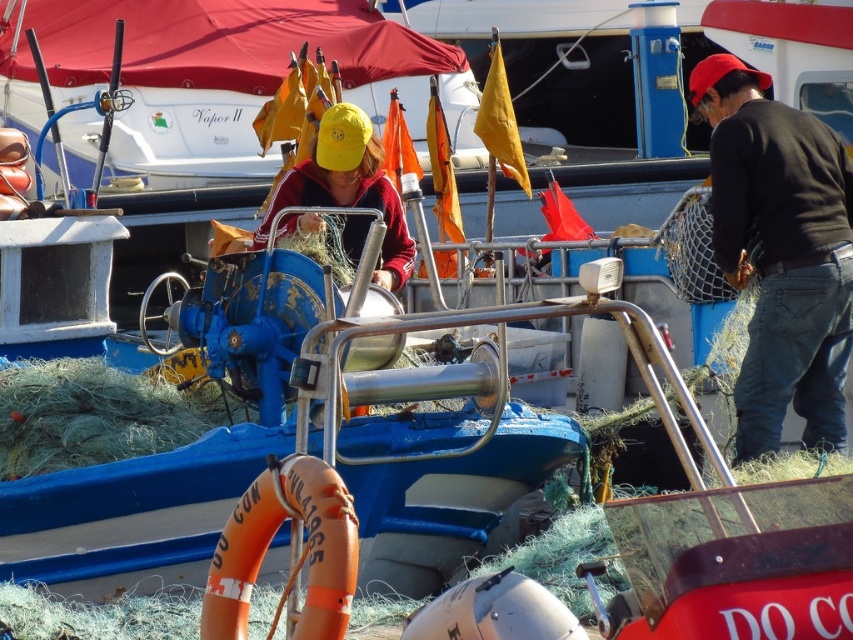
Who is more forward, (x=322, y=465) or (x=399, y=275)?

Positioned in front is point (x=322, y=465).

Is orange rubber life jacket at lower center to the right of matte red jacket at center from the viewer's perspective?

Correct, you'll find orange rubber life jacket at lower center to the right of matte red jacket at center.

Which is in front, point (329, 499) or point (384, 218)?

Point (329, 499)

Locate an element on the screen. This screenshot has height=640, width=853. orange rubber life jacket at lower center is located at coordinates (294, 561).

Does black cotton shirt at right have a greater width compared to orange rubber life jacket at lower center?

Correct, the width of black cotton shirt at right exceeds that of orange rubber life jacket at lower center.

Which of these two, black cotton shirt at right or orange rubber life jacket at lower center, stands shorter?

Standing shorter between the two is orange rubber life jacket at lower center.

The image size is (853, 640). Describe the element at coordinates (780, 252) in the screenshot. I see `black cotton shirt at right` at that location.

This screenshot has height=640, width=853. What are the coordinates of `black cotton shirt at right` in the screenshot? It's located at (780, 252).

Can you confirm if black cotton shirt at right is shorter than matte red jacket at center?

No.

How far apart are black cotton shirt at right and matte red jacket at center?

black cotton shirt at right is 6.41 meters from matte red jacket at center.

Is point (753, 371) closer to viewer compared to point (387, 209)?

Yes.

Locate an element on the screen. black cotton shirt at right is located at coordinates (780, 252).